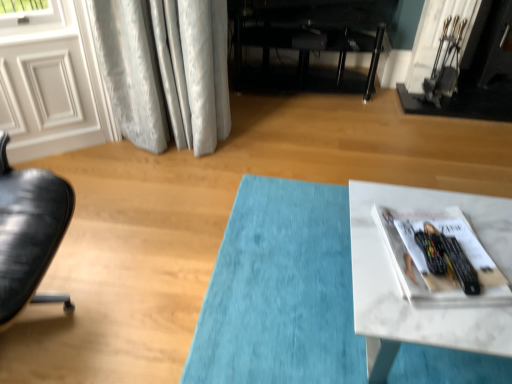
What are the coordinates of `vacant area on top of white glossy door at upper left (from a real-world perspective)` in the screenshot? It's located at (32, 30).